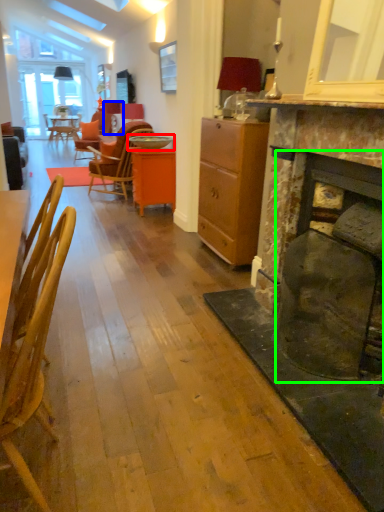
Question: Which object is the closest to the round table (highlighted by a red box)? Choose among these: lamp (highlighted by a blue box) or fireplace (highlighted by a green box).

Choices:
 (A) lamp
 (B) fireplace

Answer: (A)